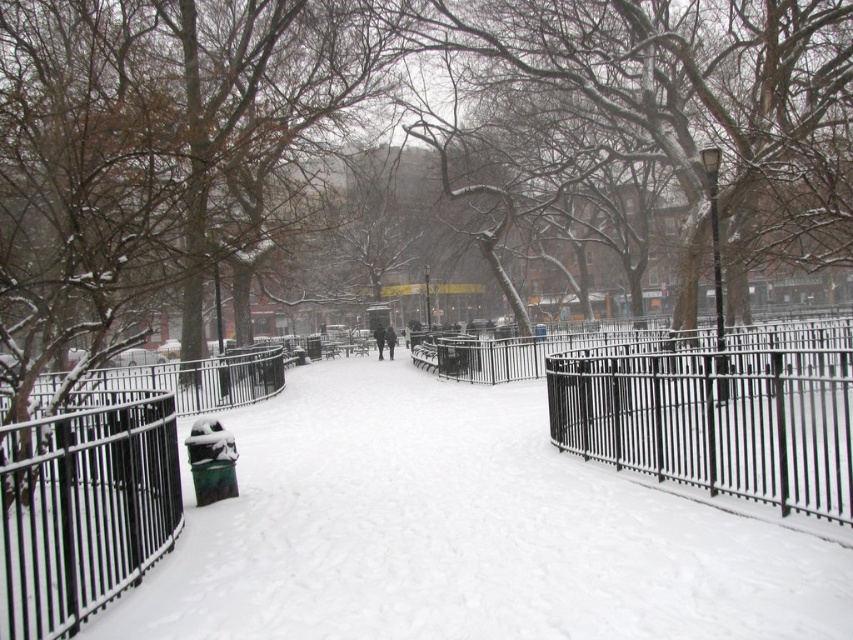
Looking at this image, you are standing at the point labeled as point (695, 404). You want to walk towards the nearest trash bin. Which direction should you head? Please provide your answer in terms of the scene description provided.

The nearest trash bin is located to the left side of the path. Since the black metal fence at center is represented by point (695, 404), you should head towards the left side of the path to reach the nearest trash bin.